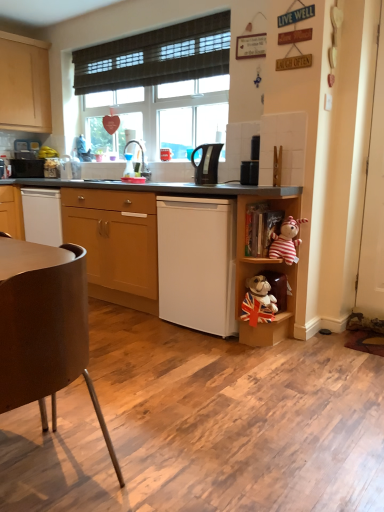
Find the location of a particular element. free space in front of wooden shelf at right, acting as the second shelf starting from the top is located at coordinates (275, 360).